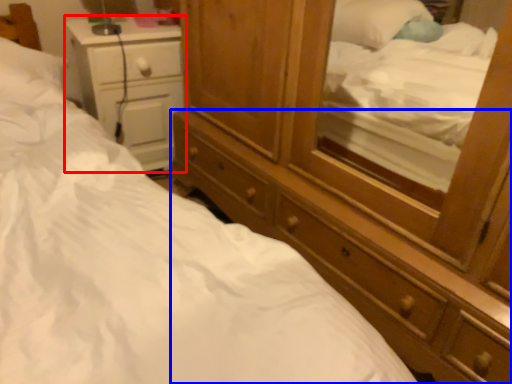
Question: Which of the following is the closest to the observer, nightstand (highlighted by a red box) or dresser (highlighted by a blue box)?

Choices:
 (A) nightstand
 (B) dresser

Answer: (B)